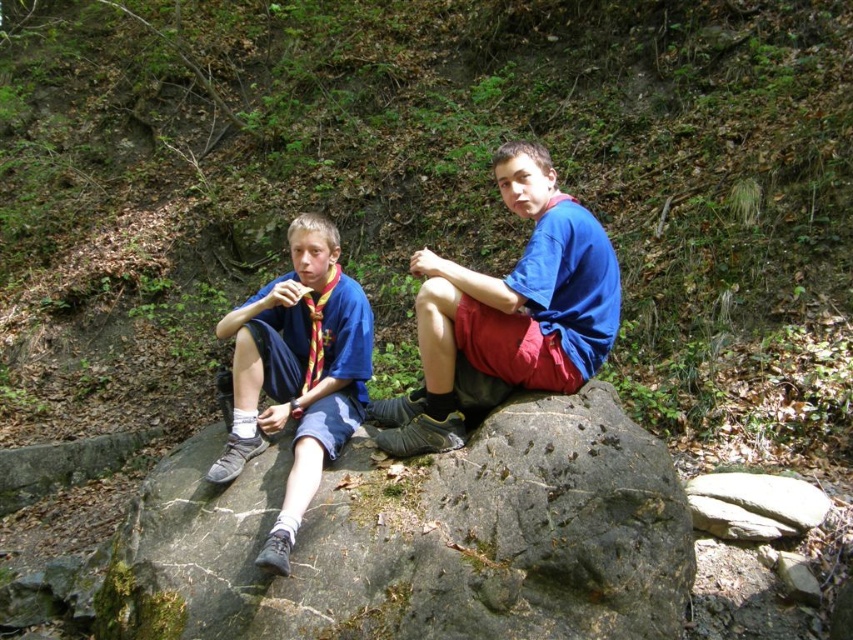
Question: Estimate the real-world distances between objects in this image. Which object is farther from the matte blue shorts at left?

Choices:
 (A) gray rough rock at center
 (B) blue fabric shorts at center

Answer: (B)

Question: Which of the following is the closest to the observer?

Choices:
 (A) (294, 461)
 (B) (398, 554)
 (C) (415, 410)

Answer: (B)

Question: Is gray rough rock at center wider than blue fabric shorts at center?

Choices:
 (A) no
 (B) yes

Answer: (B)

Question: Which object appears closest to the camera in this image?

Choices:
 (A) matte blue shorts at left
 (B) gray rough rock at center
 (C) blue fabric shorts at center

Answer: (B)

Question: Can you confirm if gray rough rock at center is positioned to the right of blue fabric shorts at center?

Choices:
 (A) yes
 (B) no

Answer: (B)

Question: Is gray rough rock at center below matte blue shorts at left?

Choices:
 (A) no
 (B) yes

Answer: (B)